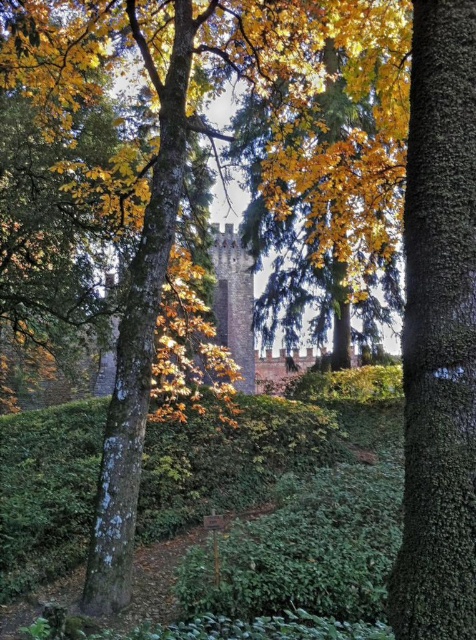
Question: Which is farther from the green rough bark tree trunk at center?

Choices:
 (A) smooth brown tree trunk at right
 (B) green leafy hedge at center

Answer: (A)

Question: Can you confirm if smooth brown tree trunk at right is wider than green leafy hedge at center?

Choices:
 (A) no
 (B) yes

Answer: (A)

Question: Is green leafy hedge at center positioned in front of green rough bark tree trunk at center?

Choices:
 (A) no
 (B) yes

Answer: (A)

Question: Estimate the real-world distances between objects in this image. Which object is farther from the green rough bark tree trunk at center?

Choices:
 (A) green leafy hedge at center
 (B) smooth brown tree trunk at right

Answer: (B)

Question: Which of the following is the closest to the observer?

Choices:
 (A) (225, 499)
 (B) (137, 484)

Answer: (B)

Question: Does smooth brown tree trunk at right have a larger size compared to green leafy hedge at center?

Choices:
 (A) no
 (B) yes

Answer: (B)